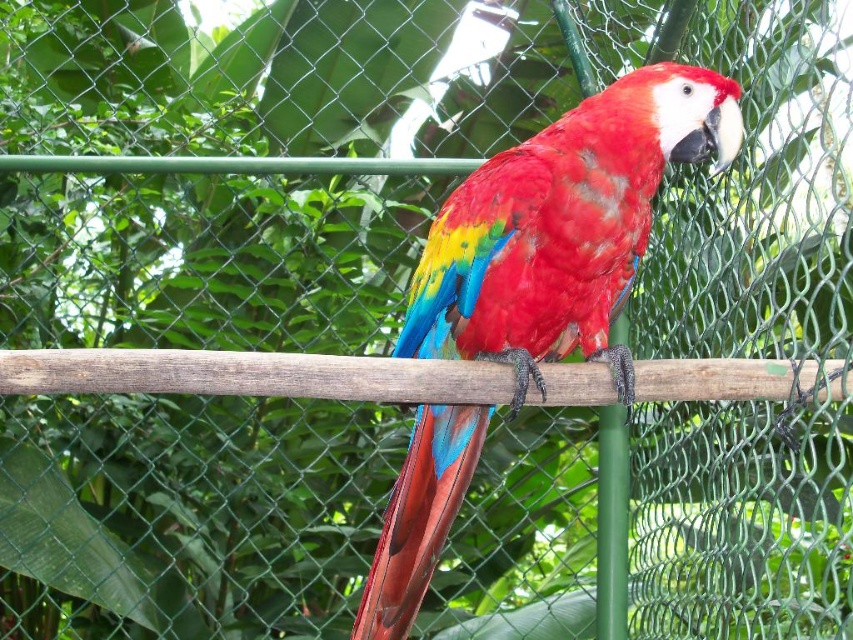
You are a zookeeper who needs to place a feeding tray for the shiny red parrot at center. According to the image, where should you position the feeding tray relative to the parrot?

The shiny red parrot at center is located at point (563, 227). The feeding tray should be placed directly below the parrot at position (563, 227) plus a downward adjustment to ensure accessibility.

You are a zookeeper observing the aviary. You notice the shiny red parrot at center and the wooden pole at center. Which object is located to the left of the other?

The wooden pole at center is located to the left of the shiny red parrot at center because the parrot is positioned on the right side of the pole.

You are a zookeeper observing the enclosure. You notice the shiny red parrot at center and the wooden pole at center. Which object is positioned higher in the image?

The shiny red parrot at center is located above the wooden pole at center, so it is positioned higher in the image.